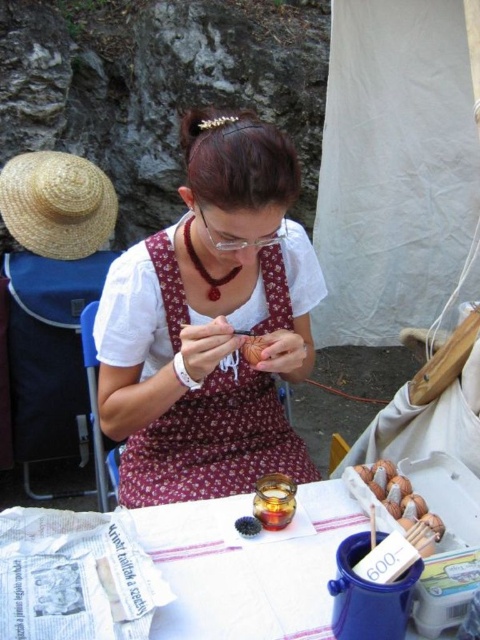
You are an artist who needs to place a small golden object on either the white paper at lower center or the brown wooden beads at lower right. Considering their heights, which surface would allow the golden object to be more visible from above?

The white paper at lower center has a greater height compared to the brown wooden beads at lower right, so placing the golden object on the white paper at lower center would make it more visible from above.

You are setting up a craft table and need to place both the matte brown apron at center and the brown textured bread at center on the table. Which object should you place first to ensure there is enough space for both?

The matte brown apron at center has a larger width than the brown textured bread at center. To ensure enough space, place the matte brown apron at center first, then the brown textured bread at center.

You are a photographer wanting to capture the golden jar in the image. The golden jar is located at point (x=210, y=323). Where should you focus your camera to ensure the golden jar is in sharp focus?

The point (x=210, y=323) is on the matte brown apron at center, so you should focus your camera on the matte brown apron at center to ensure the golden jar is in sharp focus.